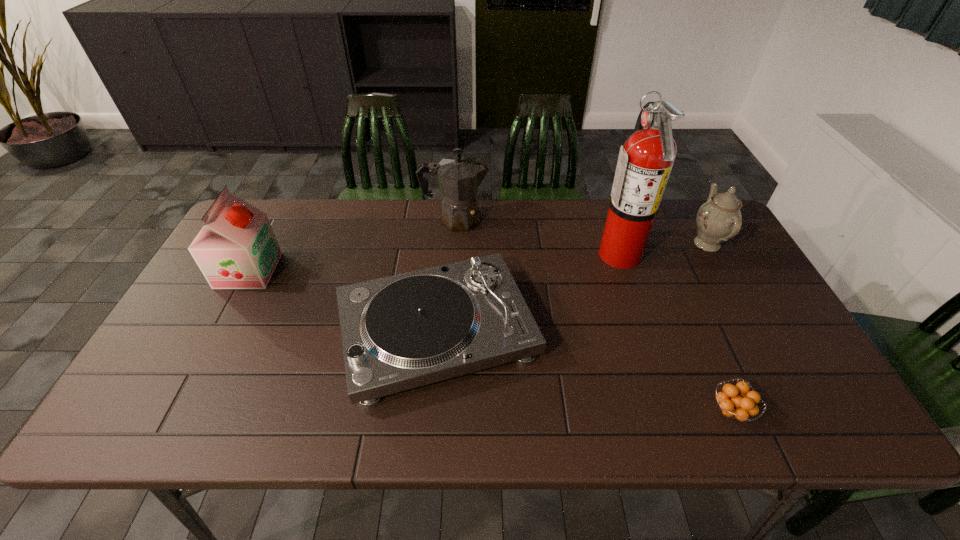
This screenshot has width=960, height=540. What are the coordinates of `vacant area situated 0.260m on the nozzle side of the fourth object from left to right` in the screenshot? It's located at (512, 253).

This screenshot has height=540, width=960. Identify the location of free region located 0.350m on the nozzle side of the fourth object from left to right. (482, 253).

At what (x,y) coordinates should I click in order to perform the action: click on free space located on the pouring side of the coffeepot. Please return your answer as a coordinate pair (x, y). This screenshot has width=960, height=540. Looking at the image, I should click on (588, 219).

Find the location of a particular element. The height and width of the screenshot is (540, 960). vacant space located 0.090m with the cap open on the soya milk is located at coordinates (305, 271).

Where is `free location located on the spout of the chinaware`? The width and height of the screenshot is (960, 540). free location located on the spout of the chinaware is located at coordinates 610,244.

Where is `vacant point located 0.120m on the spout of the chinaware`? Image resolution: width=960 pixels, height=540 pixels. vacant point located 0.120m on the spout of the chinaware is located at coordinates click(649, 244).

Image resolution: width=960 pixels, height=540 pixels. In order to click on free region located 0.240m on the spout of the chinaware in this screenshot , I will do `click(610, 244)`.

Locate an element on the screen. vacant area situated on the back of the record player is located at coordinates (444, 246).

I want to click on vacant space located on the left of the orange fruit, so click(586, 411).

The image size is (960, 540). In order to click on fire extinguisher located at the far edge in this screenshot , I will do `click(644, 165)`.